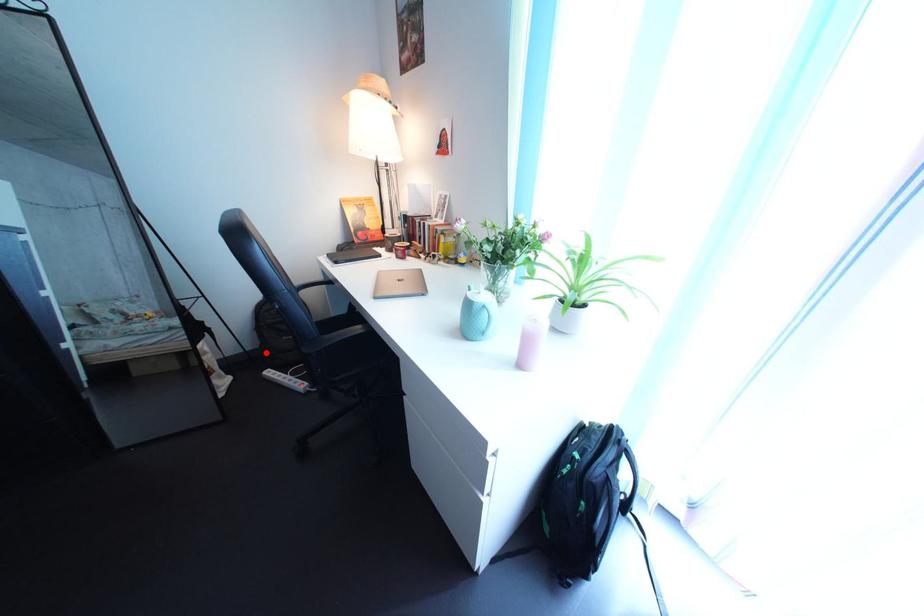
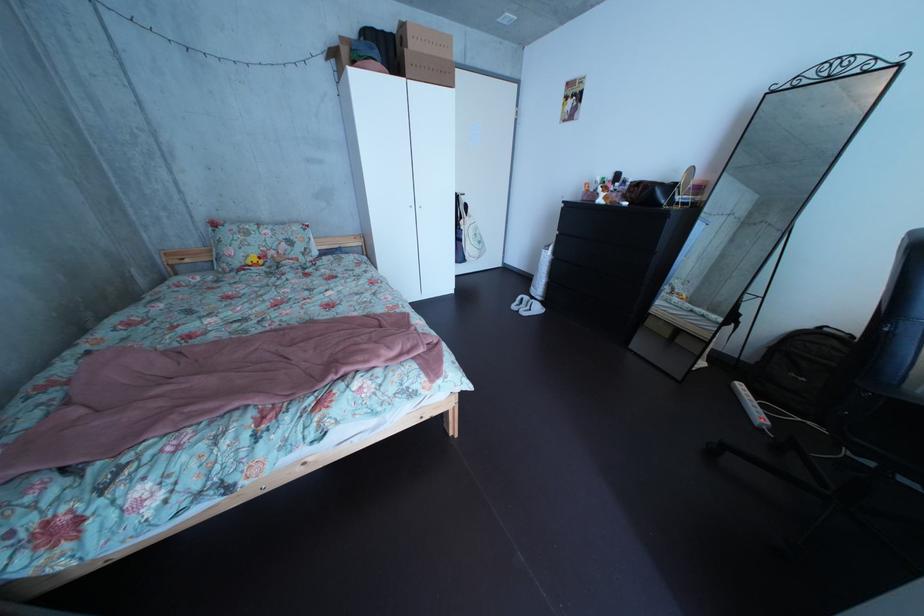
Where in the second image is the point corresponding to the highlighted location from the first image?

(763, 363)